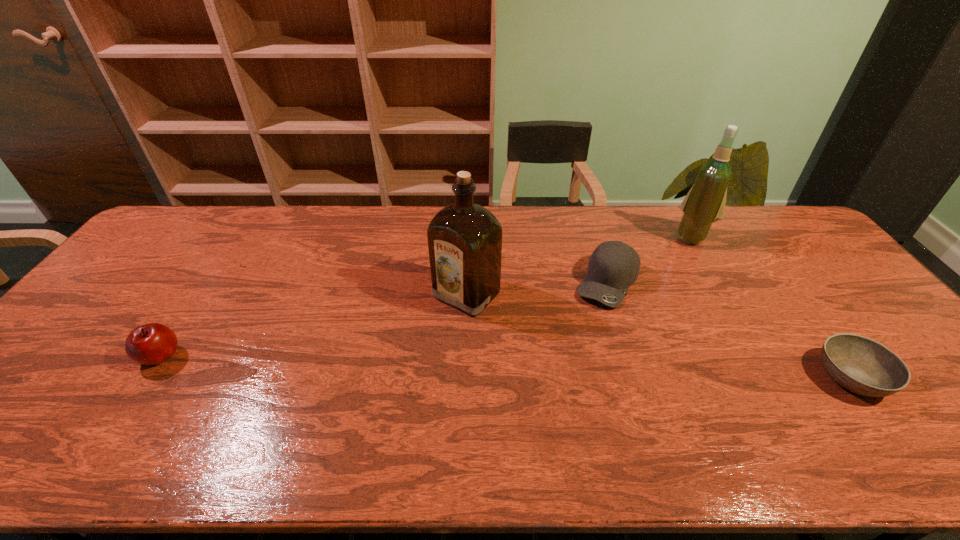
You are a GUI agent. You are given a task and a screenshot of the screen. Output one action in this format:
    pyautogui.click(x=<x>, y=<y>)
    Task: Click on the object that is at the right edge
    
    Given the screenshot: What is the action you would take?
    pyautogui.click(x=863, y=366)

This screenshot has width=960, height=540. I want to click on object that is at the near right corner, so click(863, 366).

Where is `vacant region at the far edge of the desktop`? vacant region at the far edge of the desktop is located at coordinates (267, 231).

In order to click on vacant point at the near edge in this screenshot , I will do `click(132, 392)`.

At what (x,y) coordinates should I click in order to perform the action: click on vacant space at the far right corner. Please return your answer as a coordinate pair (x, y). This screenshot has width=960, height=540. Looking at the image, I should click on (768, 208).

Identify the location of free space between the liquor and the farthest object. (580, 265).

Image resolution: width=960 pixels, height=540 pixels. Find the location of `vacant area between the third object from left to right and the liquor`. vacant area between the third object from left to right and the liquor is located at coordinates (537, 288).

Where is `unoccupied area between the baseball cap and the leftmost object`? unoccupied area between the baseball cap and the leftmost object is located at coordinates (384, 319).

Find the location of a particular element. The width and height of the screenshot is (960, 540). vacant area that lies between the baseball cap and the shortest object is located at coordinates (730, 329).

Identify the location of vacant area between the wine bottle and the third object from left to right. Image resolution: width=960 pixels, height=540 pixels. (650, 259).